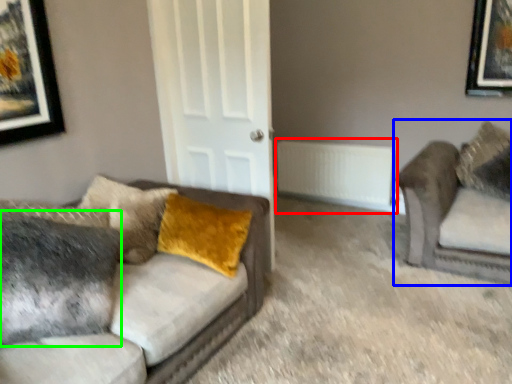
Question: Considering the real-world distances, which object is farthest from radiator (highlighted by a red box)? studio couch (highlighted by a blue box) or pillow (highlighted by a green box)?

Choices:
 (A) studio couch
 (B) pillow

Answer: (B)